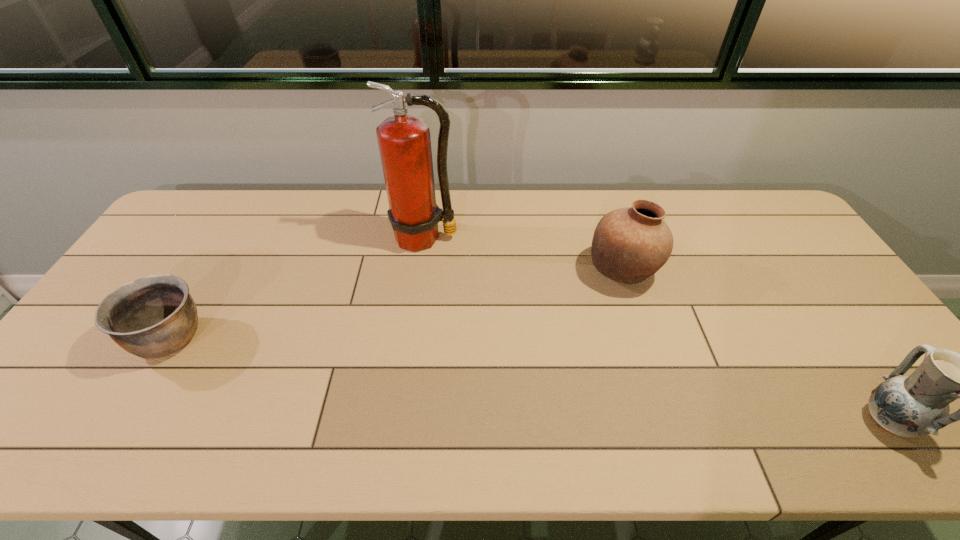
Identify the location of free space that is in between the shortest object and the nearest pottery. (529, 379).

Identify the location of empty space between the shortest pottery and the tallest object. This screenshot has height=540, width=960. (298, 288).

I want to click on empty space that is in between the rightmost pottery and the fire extinguisher, so click(x=656, y=329).

Identify which object is the third closest to the farthest pottery. Please provide its 2D coordinates. Your answer should be formatted as a tuple, i.e. [(x, y)], where the tuple contains the x and y coordinates of a point satisfying the conditions above.

[(155, 316)]

Find the location of a particular element. The height and width of the screenshot is (540, 960). the closest object to the second pottery from left to right is located at coordinates (404, 141).

I want to click on pottery that is the second nearest to the fire extinguisher, so click(x=155, y=316).

Identify the location of pottery that is the third closest one to the third object from right to left. Image resolution: width=960 pixels, height=540 pixels. (917, 405).